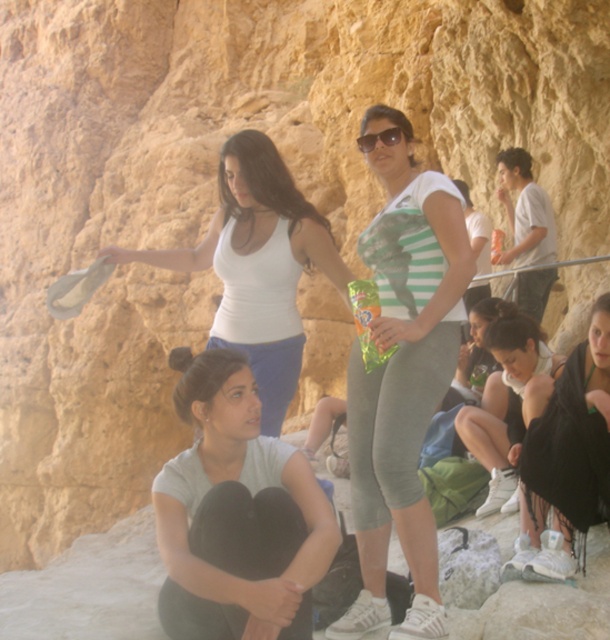
Does green striped tank top at center have a lesser height compared to gray matte shirt at lower center?

Incorrect, green striped tank top at center's height does not fall short of gray matte shirt at lower center's.

Does green striped tank top at center have a larger size compared to gray matte shirt at lower center?

Incorrect, green striped tank top at center is not larger than gray matte shirt at lower center.

This screenshot has height=640, width=610. Identify the location of green striped tank top at center. (403, 385).

Where is `green striped tank top at center`? This screenshot has width=610, height=640. green striped tank top at center is located at coordinates 403,385.

Can you confirm if gray matte shirt at lower center is positioned below matte black sunglasses at center?

Correct, gray matte shirt at lower center is located below matte black sunglasses at center.

Is point (224, 356) less distant than point (406, 138)?

Yes.

Where is `gray matte shirt at lower center`? Image resolution: width=610 pixels, height=640 pixels. gray matte shirt at lower center is located at coordinates (237, 513).

This screenshot has width=610, height=640. Describe the element at coordinates (253, 216) in the screenshot. I see `white matte tank top at upper center` at that location.

Is white matte tank top at upper center positioned behind matte black sunglasses at center?

No, it is in front of matte black sunglasses at center.

The width and height of the screenshot is (610, 640). What do you see at coordinates (253, 216) in the screenshot?
I see `white matte tank top at upper center` at bounding box center [253, 216].

I want to click on white matte tank top at upper center, so click(x=253, y=216).